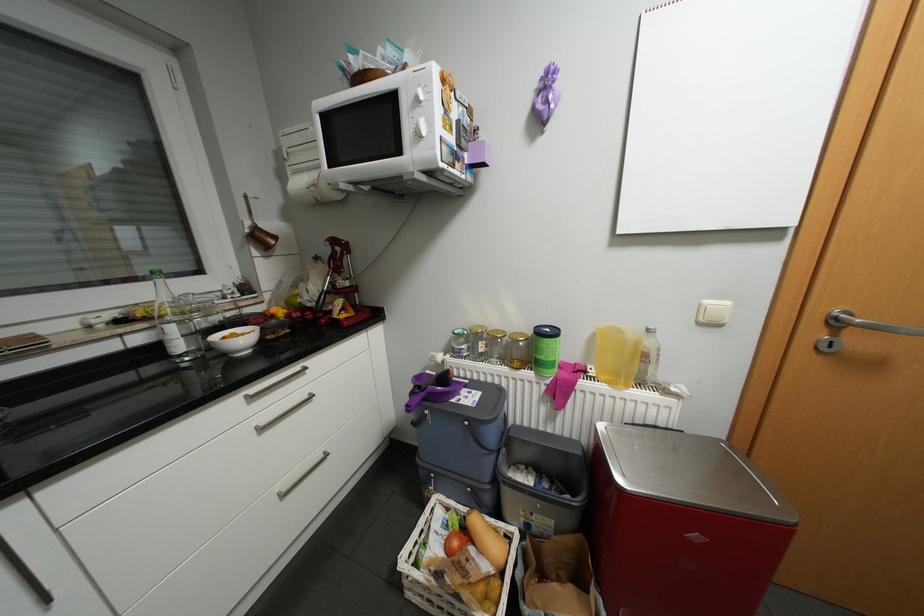
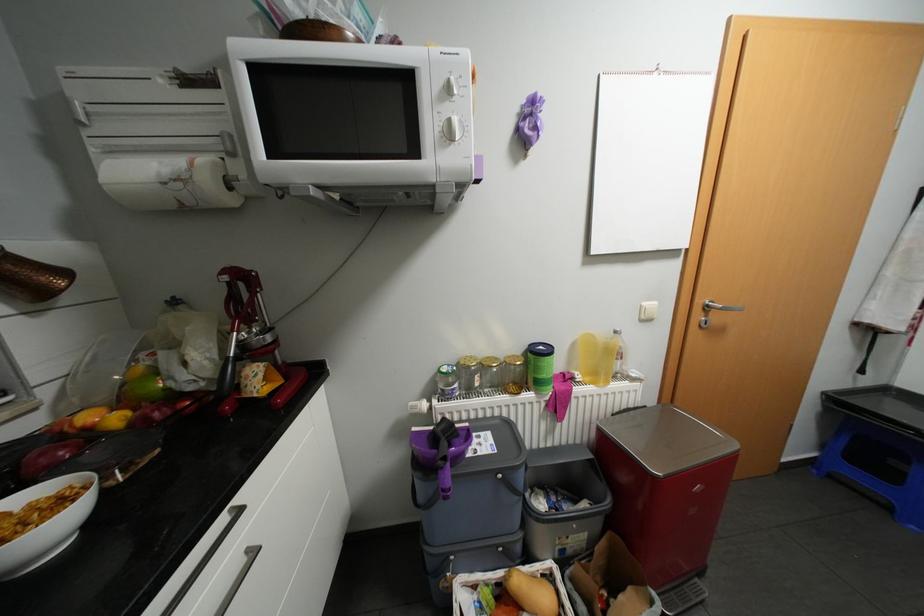
In the second image, find the point that corresponds to point 464,331 in the first image.

(452, 369)